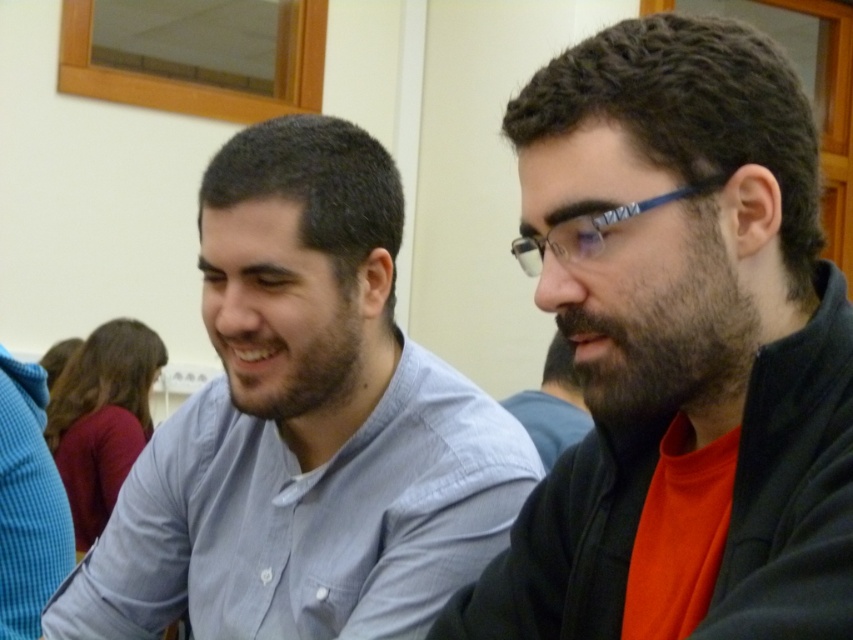
You are a photographer trying to capture a portrait of the two people in the scene. You notice the matte black jacket at right and the beard at center. Which object should you adjust to ensure both are fully visible in the frame?

The matte black jacket at right is much taller than the beard at center, so you should adjust the camera angle or framing to accommodate the height difference between the matte black jacket at right and the beard at center, ensuring both are fully visible.

You are a photographer trying to capture the best angle of the two people in the scene. Since the light blue shirt at center and the beard at center are both at the center, which one is lower in the image?

The light blue shirt at center is positioned under the beard at center, so it is lower in the image.

You are a tailor measuring clothes for two customers. The first customer is wearing a matte black jacket at right, and the second is wearing a light blue shirt at center. Which garment has a shorter vertical length?

The matte black jacket at right has a lesser height compared to the light blue shirt at center, so the matte black jacket at right is shorter in vertical length.